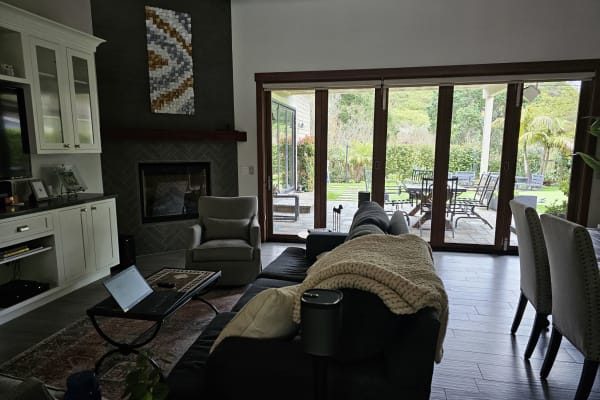
Image resolution: width=600 pixels, height=400 pixels. I want to click on window, so click(x=536, y=133), click(x=486, y=149), click(x=412, y=151), click(x=330, y=148), click(x=287, y=152).